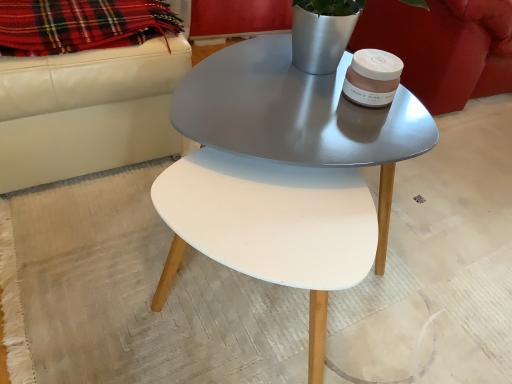
The height and width of the screenshot is (384, 512). I want to click on vacant space situated on the left part of metallic gray coffee table at center, so click(x=79, y=260).